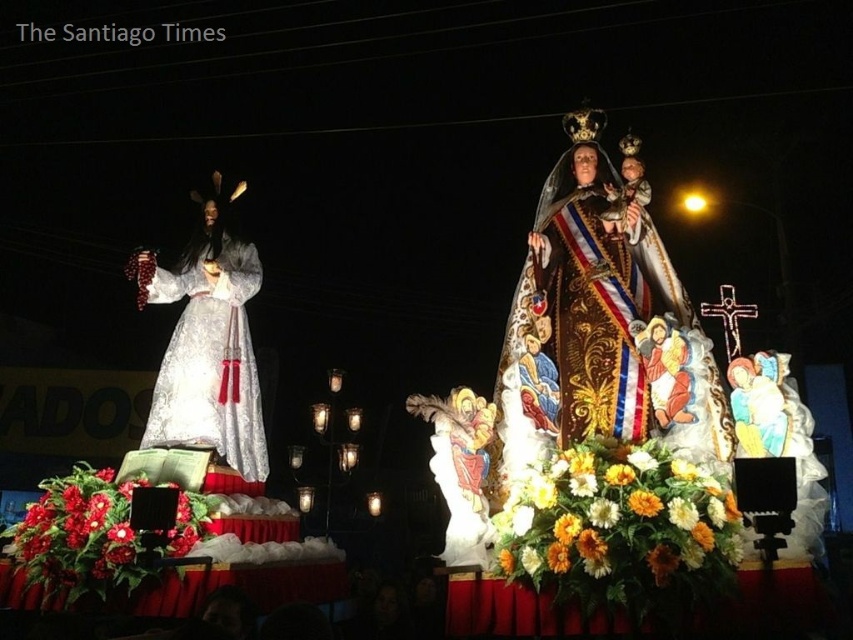
How distant is yellow fabric flowers at center from red floral arrangement at lower left?

The distance of yellow fabric flowers at center from red floral arrangement at lower left is 52.48 meters.

Is yellow fabric flowers at center smaller than red floral arrangement at lower left?

Correct, yellow fabric flowers at center occupies less space than red floral arrangement at lower left.

Who is more distant from viewer, (726, 545) or (128, 490)?

The point (128, 490) is behind.

Locate an element on the screen. This screenshot has width=853, height=640. yellow fabric flowers at center is located at coordinates (618, 522).

Between white satin statue at left and red matte flower at center, which one is positioned higher?

Positioned higher is white satin statue at left.

Who is more forward, (146, 269) or (123, 529)?

Point (123, 529) is in front.

Is point (196, 266) positioned behind point (122, 524)?

Yes.

In order to click on white satin statue at left in this screenshot , I will do `click(207, 348)`.

Does point (184, 365) come behind point (97, 568)?

Yes.

Is point (161, 410) closer to camera compared to point (131, 556)?

No, (161, 410) is behind (131, 556).

Identify the location of white satin statue at left. The height and width of the screenshot is (640, 853). (207, 348).

This screenshot has width=853, height=640. I want to click on white satin statue at left, so click(207, 348).